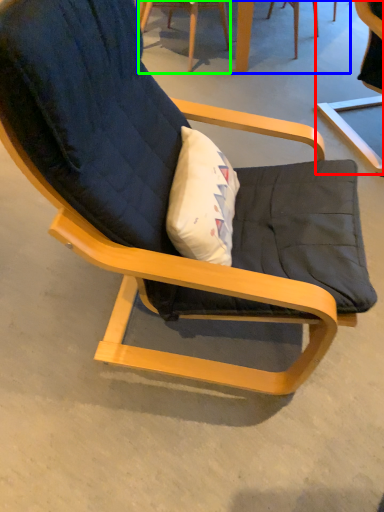
Question: Considering the real-world distances, which object is closest to chair (highlighted by a red box)? table (highlighted by a blue box) or chair (highlighted by a green box).

Choices:
 (A) table
 (B) chair

Answer: (A)